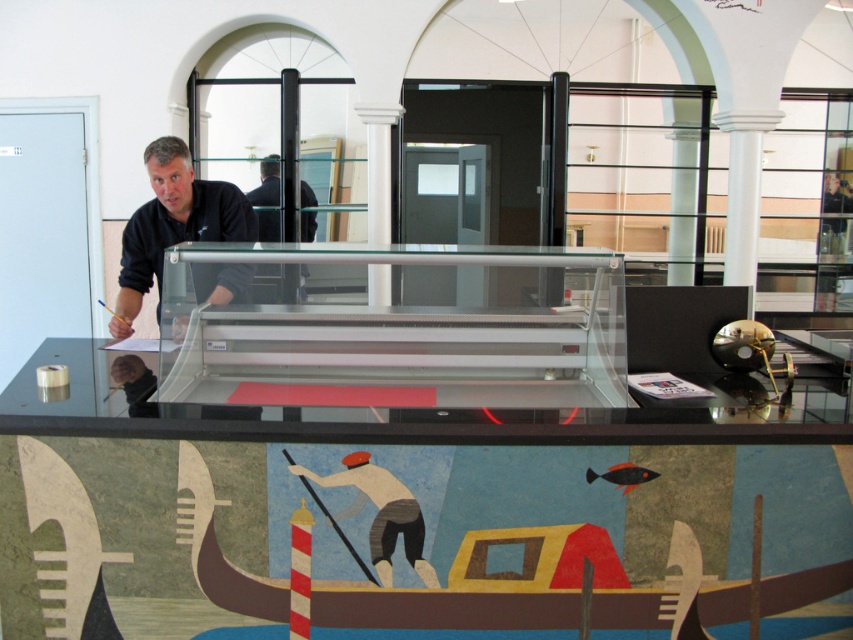
Who is lower down, black matte shirt at upper left or dark blue shirt at center?

black matte shirt at upper left is lower down.

Locate an element on the screen. Image resolution: width=853 pixels, height=640 pixels. black matte shirt at upper left is located at coordinates (173, 224).

Identify the location of black matte shirt at upper left. (173, 224).